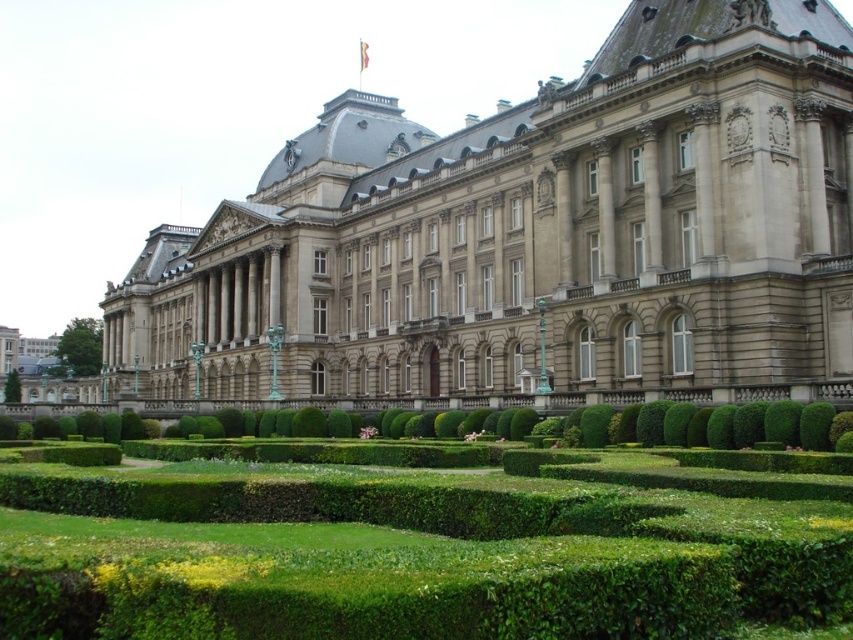
Question: Among these points, which one is farthest from the camera?

Choices:
 (A) (506, 572)
 (B) (231, 218)

Answer: (B)

Question: Is smooth stone palace at center to the right of green leafy hedge at center from the viewer's perspective?

Choices:
 (A) yes
 (B) no

Answer: (B)

Question: Is smooth stone palace at center bigger than green leafy hedge at center?

Choices:
 (A) no
 (B) yes

Answer: (B)

Question: Can you confirm if smooth stone palace at center is smaller than green leafy hedge at center?

Choices:
 (A) no
 (B) yes

Answer: (A)